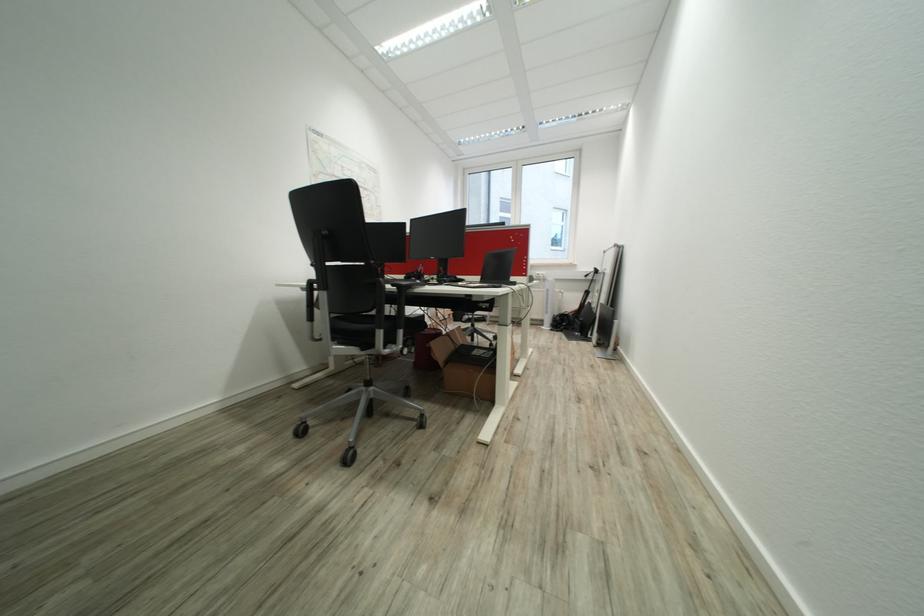
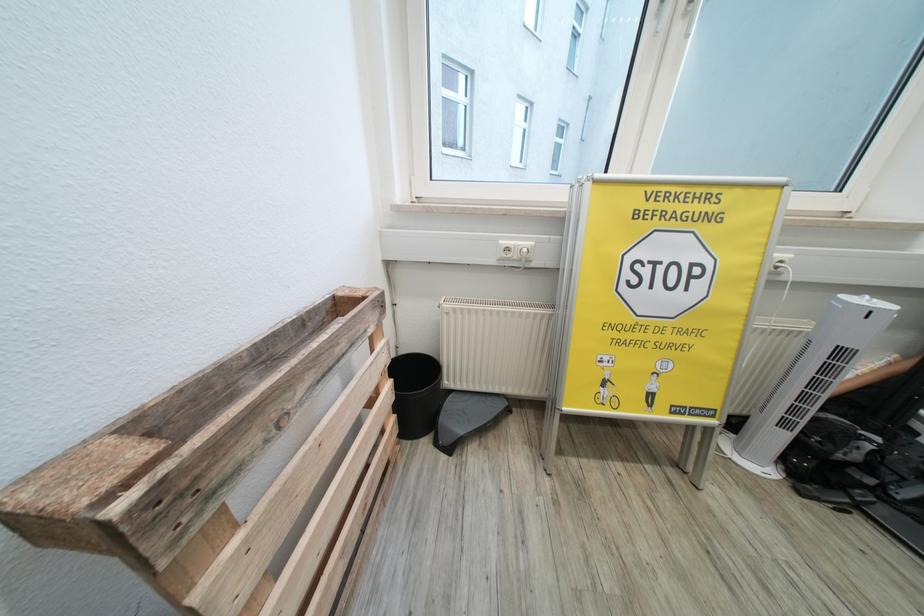
Question: The images are taken continuously from a first-person perspective. In which direction are you moving?

Choices:
 (A) Left
 (B) Right
 (C) Forward
 (D) Backward

Answer: (C)